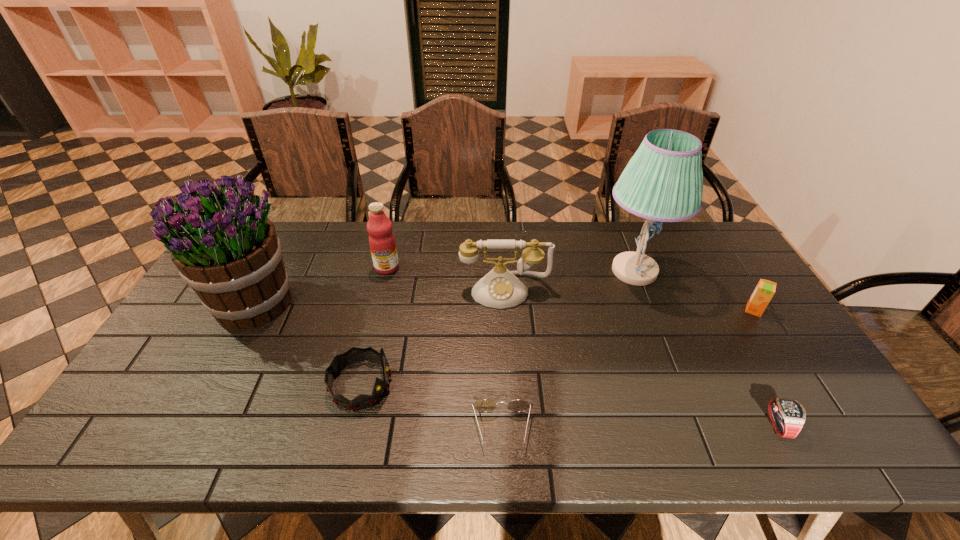
Locate an element on the screen. vacant space located 0.180m on the right of the bouquet is located at coordinates (358, 303).

Where is `free space located 0.210m on the label of the third tallest object`? free space located 0.210m on the label of the third tallest object is located at coordinates (373, 324).

Locate an element on the screen. This screenshot has width=960, height=540. vacant space situated on the dial of the fifth shortest object is located at coordinates (507, 327).

Image resolution: width=960 pixels, height=540 pixels. Identify the location of free location located on the front of the orange juice. (794, 374).

The image size is (960, 540). What are the coordinates of `free space located 0.240m at the front of the tiara with jewels` in the screenshot? It's located at (487, 384).

Identify the location of vacant point located 0.220m on the back of the seventh tallest object. This screenshot has height=540, width=960. (729, 338).

You are a GUI agent. You are given a task and a screenshot of the screen. Output one action in this format:
    pyautogui.click(x=<x>, y=<y>)
    Task: Click on the lamp that is at the far edge
    The width and height of the screenshot is (960, 540).
    Given the screenshot: What is the action you would take?
    pyautogui.click(x=663, y=182)

I want to click on fruit juice at the far edge, so [x=382, y=243].

The width and height of the screenshot is (960, 540). Find the location of `watch at the near edge`. watch at the near edge is located at coordinates (787, 416).

Locate an element on the screen. The width and height of the screenshot is (960, 540). spectacles that is positioned at the near edge is located at coordinates (485, 405).